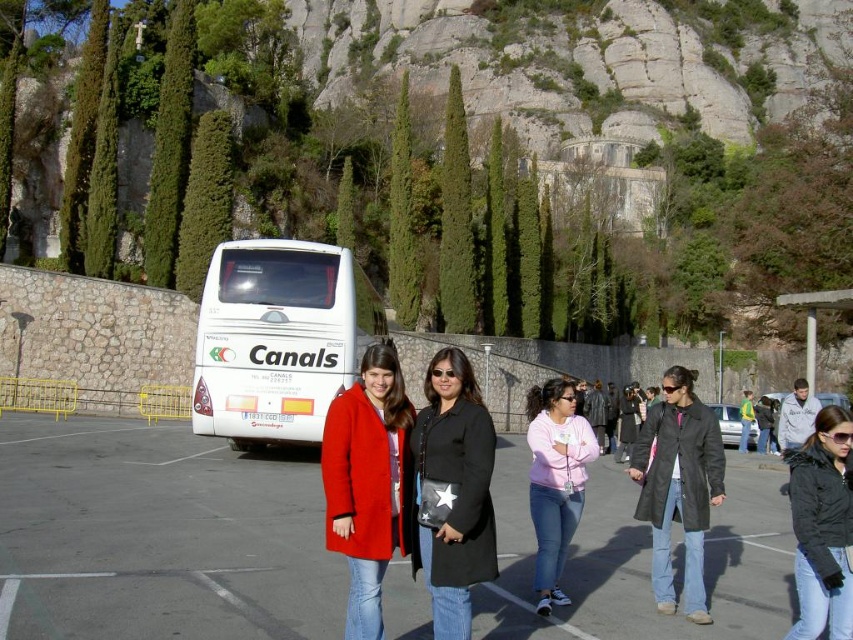
Question: Can you confirm if black matte jacket at lower right is bigger than pink fleece jacket at center?

Choices:
 (A) no
 (B) yes

Answer: (A)

Question: Is white matte bus at left positioned before pink fleece jacket at center?

Choices:
 (A) no
 (B) yes

Answer: (A)

Question: Is black leather jacket at center wider than black matte jacket at lower right?

Choices:
 (A) no
 (B) yes

Answer: (A)

Question: Which object is the closest to the white matte bus at left?

Choices:
 (A) black matte jacket at lower right
 (B) white glossy bus at upper left
 (C) pink fleece jacket at center

Answer: (B)

Question: Which point is farther to the camera?

Choices:
 (A) (798, 468)
 (B) (517, 563)
 (C) (548, 429)

Answer: (C)

Question: Which object is positioned farthest from the white matte bus at left?

Choices:
 (A) pink fleece jacket at center
 (B) matte red coat at center
 (C) black matte jacket at lower right

Answer: (C)